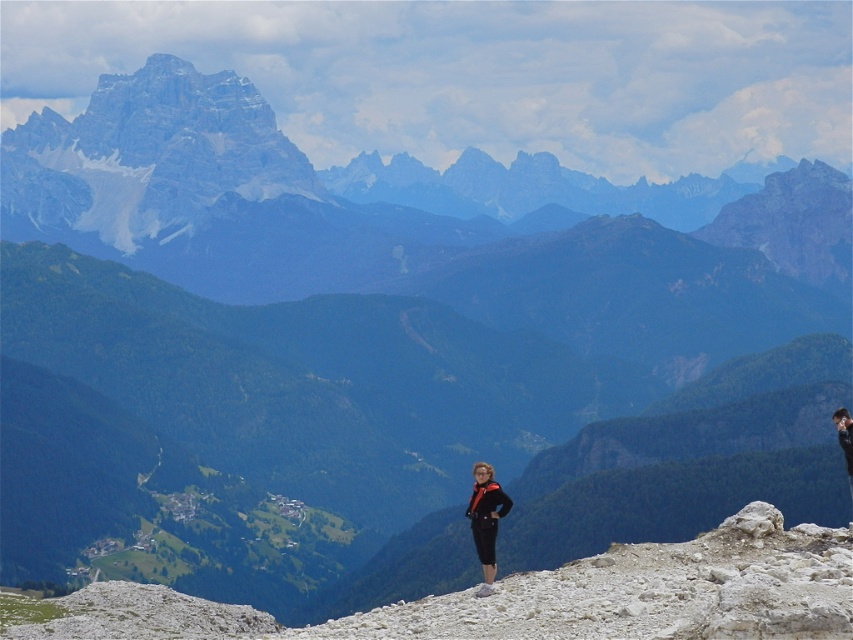
Question: Is the position of rocky mountain range at upper left more distant than that of matte black pants at center?

Choices:
 (A) no
 (B) yes

Answer: (B)

Question: Does rocky mountain range at upper left have a lesser width compared to matte black pants at center?

Choices:
 (A) yes
 (B) no

Answer: (B)

Question: Which object appears farthest from the camera in this image?

Choices:
 (A) rocky mountain range at upper left
 (B) matte black pants at center

Answer: (A)

Question: Observing the image, what is the correct spatial positioning of rocky mountain range at upper left in reference to matte black pants at center?

Choices:
 (A) left
 (B) right

Answer: (A)

Question: Which object is farther from the camera taking this photo?

Choices:
 (A) rocky mountain range at upper left
 (B) matte black pants at center

Answer: (A)

Question: Which point is farther from the camera taking this photo?

Choices:
 (A) (26, 125)
 (B) (498, 509)

Answer: (A)